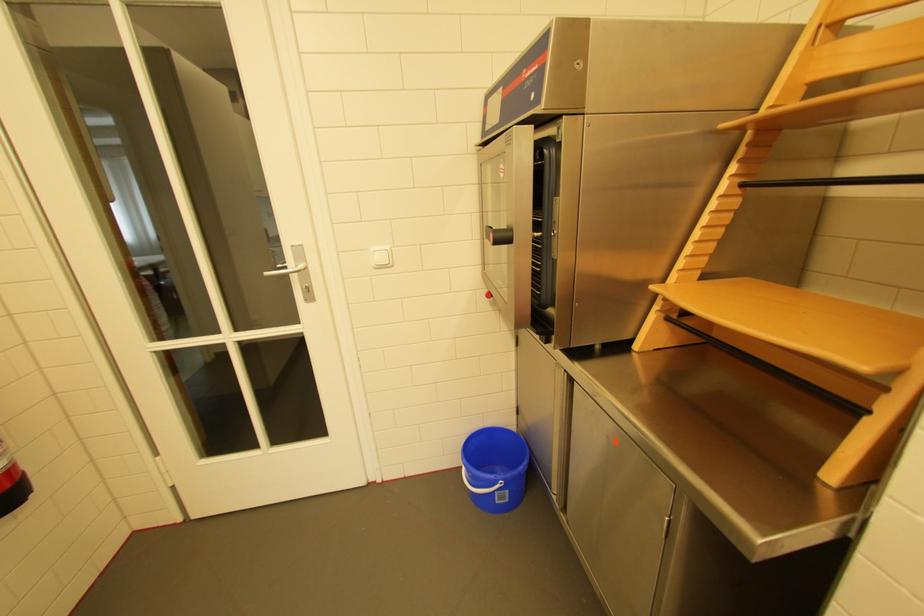
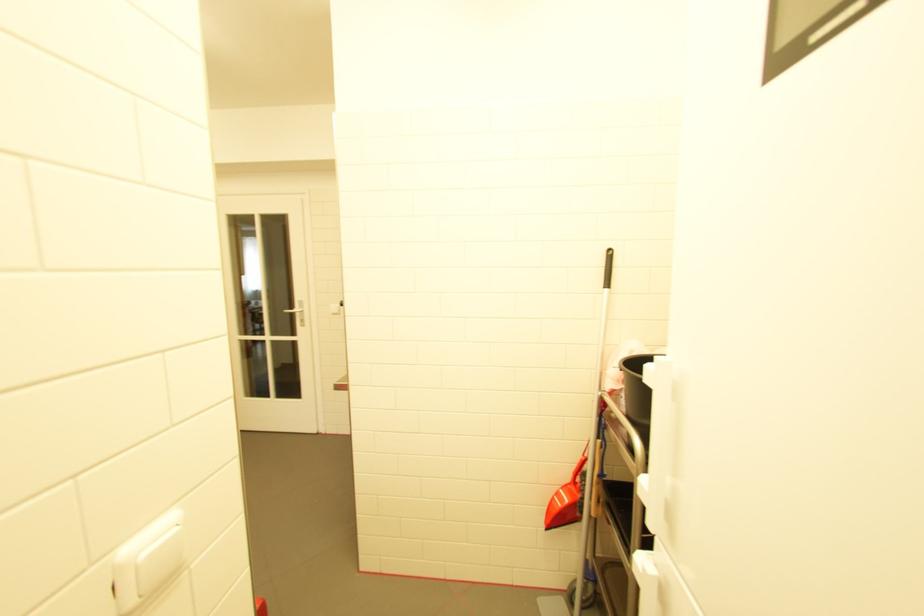
Question: I am providing you with two images of the same scene from different viewpoints. After the viewpoint changes to image2, which objects are now occluded?

Choices:
 (A) clear plastic drawer
 (B) black broom handle
 (C) white light switch
 (D) black oven handle

Answer: (D)